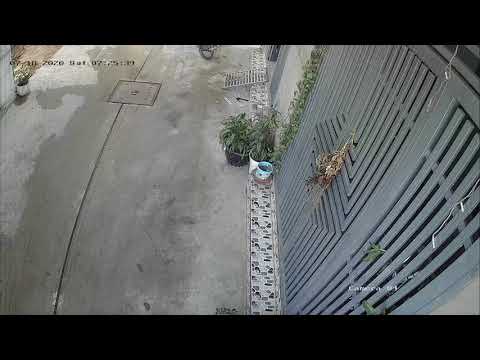
The height and width of the screenshot is (360, 480). What are the coordinates of `pot` in the screenshot? It's located at (242, 158), (24, 89), (262, 170).